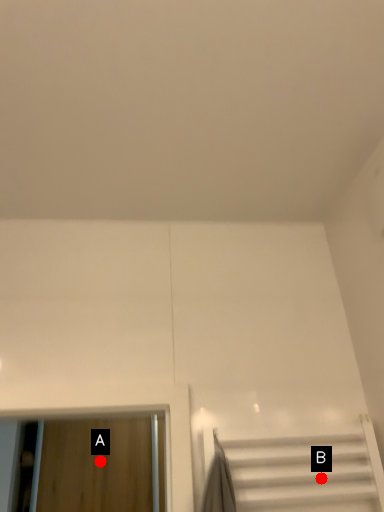
Question: Two points are circled on the image, labeled by A and B beside each circle. Which point appears farthest from the camera in this image?

Choices:
 (A) A is further
 (B) B is further

Answer: (A)